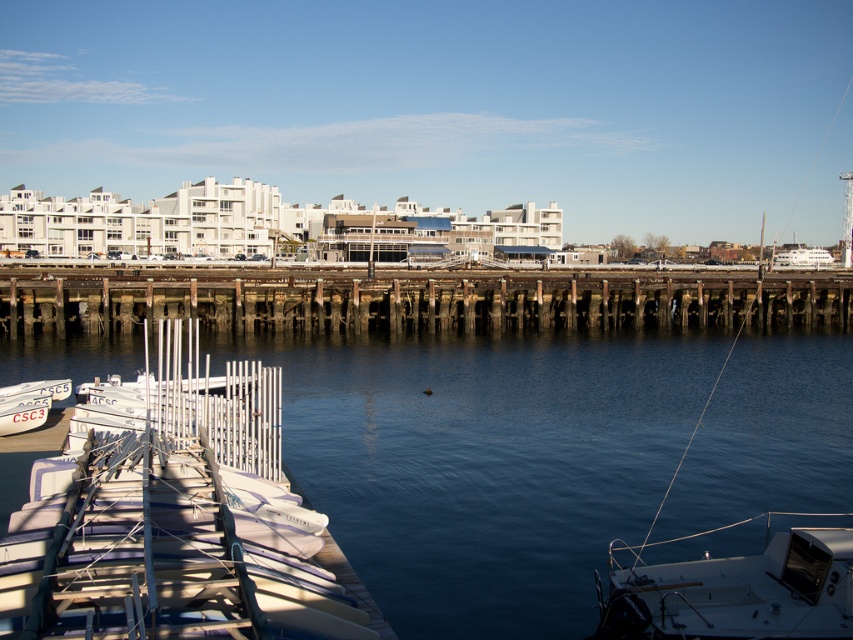
Is white matte dock at lower left further to camera compared to white matte boat at left?

Yes, it is behind white matte boat at left.

Who is more forward, (x=805, y=449) or (x=138, y=605)?

Point (x=138, y=605) is more forward.

The image size is (853, 640). What are the coordinates of `white matte dock at lower left` in the screenshot? It's located at (485, 461).

Who is taller, weathered wood dock at center or white matte boat at lower right?

Standing taller between the two is weathered wood dock at center.

Which is below, weathered wood dock at center or white matte boat at lower right?

white matte boat at lower right is below.

Which is in front, point (0, 292) or point (825, 513)?

Point (825, 513) is in front.

I want to click on weathered wood dock at center, so click(x=415, y=300).

Is white matte dock at lower left taller than weathered wood dock at center?

No.

What do you see at coordinates (485, 461) in the screenshot? This screenshot has height=640, width=853. I see `white matte dock at lower left` at bounding box center [485, 461].

The width and height of the screenshot is (853, 640). Identify the location of white matte dock at lower left. (485, 461).